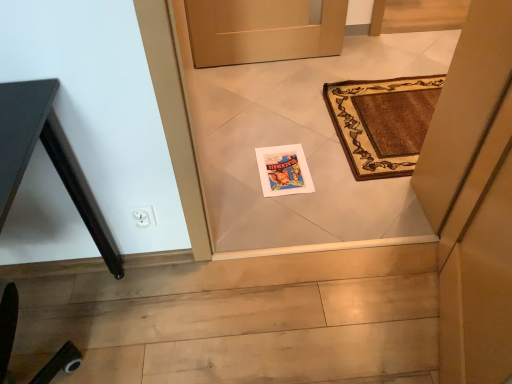
Find the location of a particular element. The width and height of the screenshot is (512, 384). free region under black matte table at left (from a real-world perspective) is located at coordinates (67, 330).